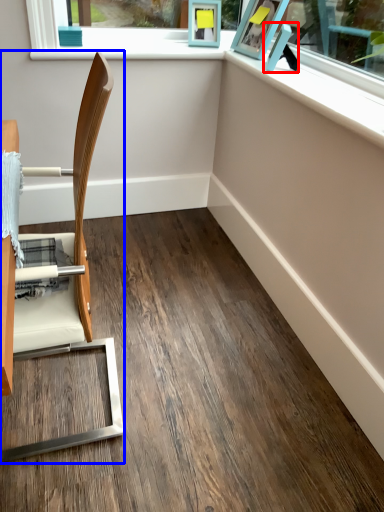
Question: Which object is further to the camera taking this photo, picture frame (highlighted by a red box) or chair (highlighted by a blue box)?

Choices:
 (A) picture frame
 (B) chair

Answer: (A)